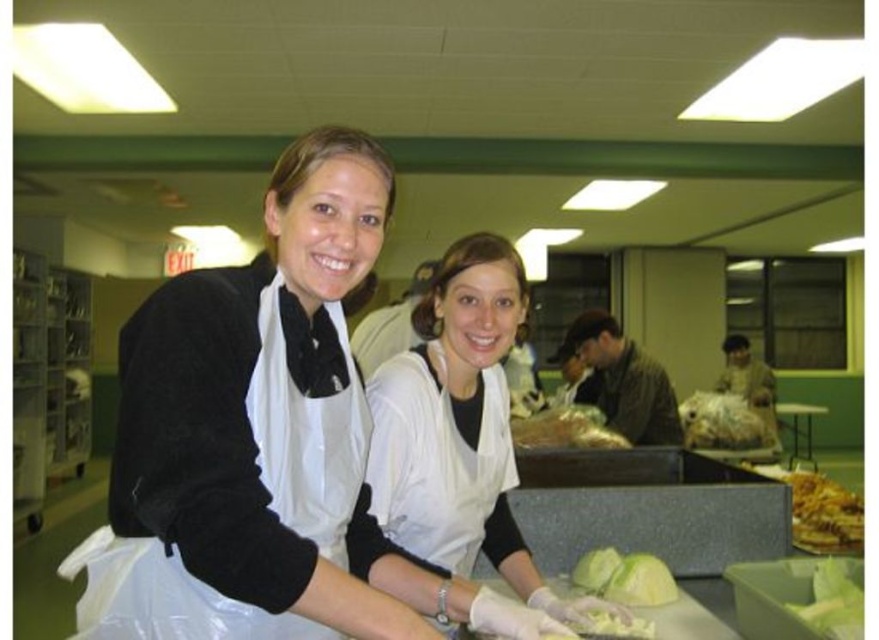
Question: Is black matte apron at center further to the viewer compared to green leafy vegetable at lower right?

Choices:
 (A) no
 (B) yes

Answer: (A)

Question: Does green matte lettuce at lower center come behind green leafy vegetable at lower right?

Choices:
 (A) no
 (B) yes

Answer: (B)

Question: Considering the relative positions of black matte apron at center and green leafy vegetable at lower right in the image provided, where is black matte apron at center located with respect to green leafy vegetable at lower right?

Choices:
 (A) below
 (B) above

Answer: (B)

Question: Estimate the real-world distances between objects in this image. Which object is farther from the black matte apron at center?

Choices:
 (A) green leafy vegetable at lower right
 (B) white matte apron at center
 (C) green matte lettuce at lower center
 (D) golden crispy fries at lower right

Answer: (D)

Question: Which point is farther to the camera?

Choices:
 (A) translucent plastic bag at center
 (B) green matte lettuce at lower center
 (C) golden crispy fries at lower right

Answer: (A)

Question: Estimate the real-world distances between objects in this image. Which object is closer to the green matte lettuce at lower center?

Choices:
 (A) green leafy vegetable at lower right
 (B) translucent plastic bag at center

Answer: (A)